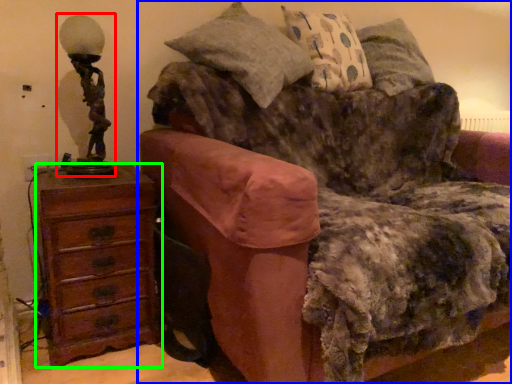
Question: Based on their relative distances, which object is nearer to table lamp (highlighted by a red box)? Choose from studio couch (highlighted by a blue box) and chest of drawers (highlighted by a green box).

Choices:
 (A) studio couch
 (B) chest of drawers

Answer: (B)